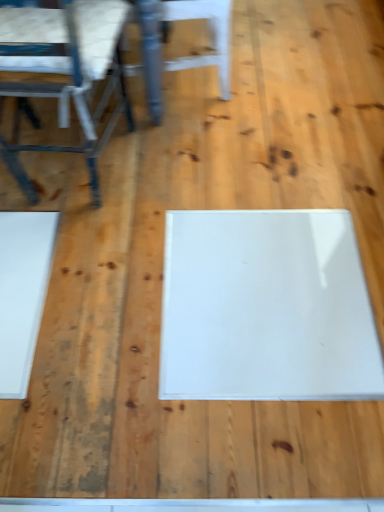
Where is `white glossy chair at upper center, which appears as the 1th chair when viewed from the right`? Image resolution: width=384 pixels, height=512 pixels. white glossy chair at upper center, which appears as the 1th chair when viewed from the right is located at coordinates (187, 56).

What do you see at coordinates (187, 56) in the screenshot? This screenshot has height=512, width=384. I see `white glossy chair at upper center, which appears as the 1th chair when viewed from the right` at bounding box center [187, 56].

The height and width of the screenshot is (512, 384). I want to click on metallic blue chair at left, acting as the first chair starting from the left, so click(x=67, y=73).

This screenshot has width=384, height=512. Describe the element at coordinates (67, 73) in the screenshot. I see `metallic blue chair at left, acting as the first chair starting from the left` at that location.

You are a GUI agent. You are given a task and a screenshot of the screen. Output one action in this format:
    pyautogui.click(x=<x>, y=<y>)
    Task: Click on the white glossy chair at upper center, which appears as the 1th chair when viewed from the right
    The height and width of the screenshot is (512, 384).
    Given the screenshot: What is the action you would take?
    pyautogui.click(x=187, y=56)

Is metallic blue chair at left, acting as the first chair starting from the left, to the left or to the right of white glossy chair at upper center, which appears as the 1th chair when viewed from the right, in the image?

metallic blue chair at left, acting as the first chair starting from the left, is positioned on white glossy chair at upper center, which appears as the 1th chair when viewed from the right,'s left side.

Is the position of metallic blue chair at left, acting as the first chair starting from the left, less distant than that of white glossy chair at upper center, which appears as the 1th chair when viewed from the right?

That is True.

Which point is more distant from viewer, (88, 42) or (155, 42)?

The point (155, 42) is more distant.

From the image's perspective, is metallic blue chair at left, which is the second chair in right-to-left order, on white glossy chair at upper center, which appears as the second chair when viewed from the left?

Incorrect, from the image's perspective, metallic blue chair at left, which is the second chair in right-to-left order, is lower than white glossy chair at upper center, which appears as the second chair when viewed from the left.

From a real-world perspective, is metallic blue chair at left, which is the second chair in right-to-left order, under white glossy chair at upper center, which appears as the second chair when viewed from the left?

No, from a real-world perspective, metallic blue chair at left, which is the second chair in right-to-left order, is not beneath white glossy chair at upper center, which appears as the second chair when viewed from the left.

Is metallic blue chair at left, acting as the first chair starting from the left, wider than white glossy chair at upper center, which appears as the second chair when viewed from the left?

Yes, metallic blue chair at left, acting as the first chair starting from the left, is wider than white glossy chair at upper center, which appears as the second chair when viewed from the left.

Between metallic blue chair at left, acting as the first chair starting from the left, and white glossy chair at upper center, which appears as the second chair when viewed from the left, which one has more height?

Standing taller between the two is metallic blue chair at left, acting as the first chair starting from the left.

Between metallic blue chair at left, which is the second chair in right-to-left order, and white glossy chair at upper center, which appears as the 1th chair when viewed from the right, which one has larger size?

metallic blue chair at left, which is the second chair in right-to-left order.

In the scene shown: Would you say metallic blue chair at left, acting as the first chair starting from the left, is outside white glossy chair at upper center, which appears as the second chair when viewed from the left?

metallic blue chair at left, acting as the first chair starting from the left, is positioned outside white glossy chair at upper center, which appears as the second chair when viewed from the left.

Is metallic blue chair at left, which is the second chair in right-to-left order, with white glossy chair at upper center, which appears as the second chair when viewed from the left?

No.

Is white glossy chair at upper center, which appears as the 1th chair when viewed from the right, at the back of metallic blue chair at left, which is the second chair in right-to-left order?

No, white glossy chair at upper center, which appears as the 1th chair when viewed from the right, is not at the back of metallic blue chair at left, which is the second chair in right-to-left order.

How different are the orientations of metallic blue chair at left, which is the second chair in right-to-left order, and white glossy chair at upper center, which appears as the 1th chair when viewed from the right, in degrees?

metallic blue chair at left, which is the second chair in right-to-left order, and white glossy chair at upper center, which appears as the 1th chair when viewed from the right, are facing 96.4 degrees away from each other.

Find the location of a particular element. This screenshot has height=512, width=384. chair below the metallic blue chair at left, acting as the first chair starting from the left (from a real-world perspective) is located at coordinates (187, 56).

Between white glossy chair at upper center, which appears as the 1th chair when viewed from the right, and metallic blue chair at left, which is the second chair in right-to-left order, which one appears on the left side from the viewer's perspective?

Positioned to the left is metallic blue chair at left, which is the second chair in right-to-left order.

Considering their positions, is white glossy chair at upper center, which appears as the 1th chair when viewed from the right, located in front of or behind metallic blue chair at left, acting as the first chair starting from the left?

white glossy chair at upper center, which appears as the 1th chair when viewed from the right, is behind metallic blue chair at left, acting as the first chair starting from the left.

Which is behind, point (158, 54) or point (86, 45)?

The point (158, 54) is farther from the camera.

From the image's perspective, between white glossy chair at upper center, which appears as the 1th chair when viewed from the right, and metallic blue chair at left, which is the second chair in right-to-left order, who is located below?

metallic blue chair at left, which is the second chair in right-to-left order, from the image's perspective.

From a real-world perspective, is white glossy chair at upper center, which appears as the 1th chair when viewed from the right, physically above metallic blue chair at left, acting as the first chair starting from the left?

Incorrect, from a real-world perspective, white glossy chair at upper center, which appears as the 1th chair when viewed from the right, is lower than metallic blue chair at left, acting as the first chair starting from the left.

Considering the sizes of white glossy chair at upper center, which appears as the second chair when viewed from the left, and metallic blue chair at left, which is the second chair in right-to-left order, in the image, is white glossy chair at upper center, which appears as the second chair when viewed from the left, wider or thinner than metallic blue chair at left, which is the second chair in right-to-left order,?

In the image, white glossy chair at upper center, which appears as the second chair when viewed from the left, appears to be more narrow than metallic blue chair at left, which is the second chair in right-to-left order.

Is white glossy chair at upper center, which appears as the 1th chair when viewed from the right, taller than metallic blue chair at left, acting as the first chair starting from the left?

Incorrect, the height of white glossy chair at upper center, which appears as the 1th chair when viewed from the right, is not larger of that of metallic blue chair at left, acting as the first chair starting from the left.

Looking at this image, considering the sizes of white glossy chair at upper center, which appears as the second chair when viewed from the left, and metallic blue chair at left, which is the second chair in right-to-left order, in the image, is white glossy chair at upper center, which appears as the second chair when viewed from the left, bigger or smaller than metallic blue chair at left, which is the second chair in right-to-left order,?

Considering their sizes, white glossy chair at upper center, which appears as the second chair when viewed from the left, takes up less space than metallic blue chair at left, which is the second chair in right-to-left order.

Can metallic blue chair at left, acting as the first chair starting from the left, be found inside white glossy chair at upper center, which appears as the second chair when viewed from the left?

No, white glossy chair at upper center, which appears as the second chair when viewed from the left, does not contain metallic blue chair at left, acting as the first chair starting from the left.

Is white glossy chair at upper center, which appears as the second chair when viewed from the left, positioned far away from metallic blue chair at left, which is the second chair in right-to-left order?

white glossy chair at upper center, which appears as the second chair when viewed from the left, is near metallic blue chair at left, which is the second chair in right-to-left order, not far away.

In the scene shown: Is white glossy chair at upper center, which appears as the second chair when viewed from the left, looking in the opposite direction of metallic blue chair at left, which is the second chair in right-to-left order?

No.

Can you tell me how much white glossy chair at upper center, which appears as the 1th chair when viewed from the right, and metallic blue chair at left, acting as the first chair starting from the left, differ in facing direction?

The angular difference between white glossy chair at upper center, which appears as the 1th chair when viewed from the right, and metallic blue chair at left, acting as the first chair starting from the left, is 96.4 degrees.

How far apart are white glossy chair at upper center, which appears as the second chair when viewed from the left, and metallic blue chair at left, acting as the first chair starting from the left?

The distance of white glossy chair at upper center, which appears as the second chair when viewed from the left, from metallic blue chair at left, acting as the first chair starting from the left, is 14.35 inches.

This screenshot has width=384, height=512. I want to click on chair on the right of metallic blue chair at left, acting as the first chair starting from the left, so click(x=187, y=56).

You are a GUI agent. You are given a task and a screenshot of the screen. Output one action in this format:
    pyautogui.click(x=<x>, y=<y>)
    Task: Click on the chair that is above the metallic blue chair at left, which is the second chair in right-to-left order (from the image's perspective)
    
    Given the screenshot: What is the action you would take?
    pyautogui.click(x=187, y=56)

Identify the location of chair located behind the metallic blue chair at left, which is the second chair in right-to-left order. (187, 56).